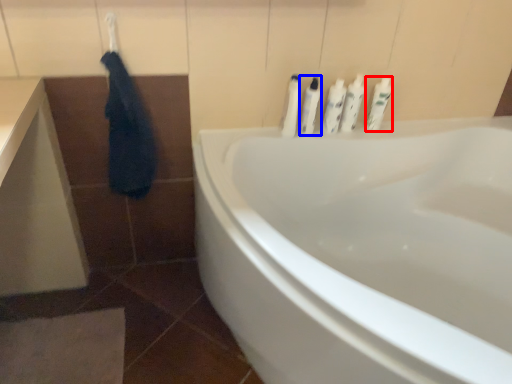
Question: Which object is closer to the camera taking this photo, toiletry (highlighted by a red box) or toiletry (highlighted by a blue box)?

Choices:
 (A) toiletry
 (B) toiletry

Answer: (B)